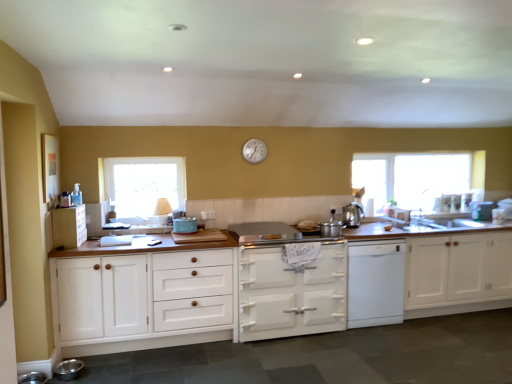
Question: In which direction should I rotate to look at silver metallic pots at center, which is counted as the second appliance, starting from the bottom?

Choices:
 (A) left
 (B) right

Answer: (B)

Question: Would you say silver metallic clock at upper center is part of silver metallic pots at center, which is counted as the 4th appliance, starting from the back,'s contents?

Choices:
 (A) no
 (B) yes

Answer: (A)

Question: Does silver metallic pots at center, which is the 2th appliance in front-to-back order, lie behind silver metallic clock at upper center?

Choices:
 (A) no
 (B) yes

Answer: (A)

Question: Is silver metallic clock at upper center at the back of silver metallic pots at center, arranged as the 3th appliance when viewed from the left?

Choices:
 (A) yes
 (B) no

Answer: (B)

Question: Is silver metallic pots at center, which is the third appliance from right to left, beside silver metallic clock at upper center?

Choices:
 (A) yes
 (B) no

Answer: (B)

Question: From a real-world perspective, is silver metallic pots at center, which is the fourth appliance from top to bottom, on top of silver metallic clock at upper center?

Choices:
 (A) no
 (B) yes

Answer: (A)

Question: From a real-world perspective, is silver metallic pots at center, which is the fourth appliance from top to bottom, under silver metallic clock at upper center?

Choices:
 (A) yes
 (B) no

Answer: (A)

Question: Does silver metallic pots at center, which is counted as the 4th appliance, starting from the back, appear on the left side of metallic stainless steel bowl at lower left, acting as the fifth appliance starting from the right?

Choices:
 (A) yes
 (B) no

Answer: (B)

Question: Is silver metallic pots at center, arranged as the 3th appliance when viewed from the left, shorter than metallic stainless steel bowl at lower left, positioned as the 1th appliance in left-to-right order?

Choices:
 (A) no
 (B) yes

Answer: (A)

Question: Considering the relative sizes of silver metallic pots at center, arranged as the 3th appliance when viewed from the left, and metallic stainless steel bowl at lower left, which is counted as the first appliance, starting from the front, in the image provided, is silver metallic pots at center, arranged as the 3th appliance when viewed from the left, wider than metallic stainless steel bowl at lower left, which is counted as the first appliance, starting from the front,?

Choices:
 (A) no
 (B) yes

Answer: (B)

Question: Is silver metallic pots at center, which is the third appliance from right to left, completely or partially outside of metallic stainless steel bowl at lower left, which is counted as the first appliance, starting from the front?

Choices:
 (A) yes
 (B) no

Answer: (A)

Question: Is metallic stainless steel bowl at lower left, the 1th appliance when ordered from bottom to top, at the back of silver metallic pots at center, which is the third appliance from right to left?

Choices:
 (A) no
 (B) yes

Answer: (A)

Question: From the image's perspective, would you say silver metallic pots at center, arranged as the 3th appliance when viewed from the left, is shown under metallic stainless steel bowl at lower left, which is counted as the first appliance, starting from the front?

Choices:
 (A) yes
 (B) no

Answer: (B)

Question: Does clear glass window at left, marked as the 1th window in a front-to-back arrangement, have a greater width compared to white glossy stove at center, positioned as the 3th cabinetry in left-to-right order?

Choices:
 (A) yes
 (B) no

Answer: (B)